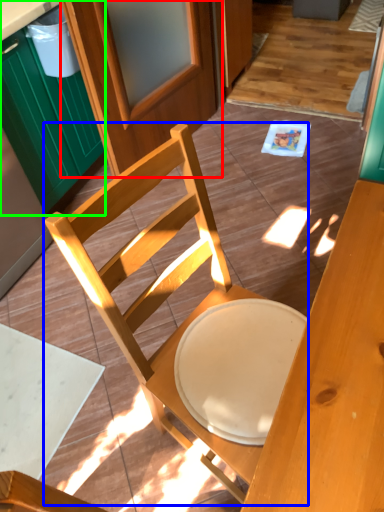
Question: Which is nearer to the screen door (highlighted by a red box)? chair (highlighted by a blue box) or cabinetry (highlighted by a green box).

Choices:
 (A) chair
 (B) cabinetry

Answer: (B)